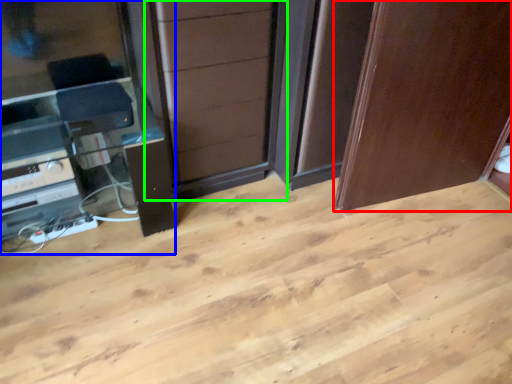
Question: Which object is positioned closest to door (highlighted by a red box)? Select from entertainment center (highlighted by a blue box) and screen door (highlighted by a green box).

Choices:
 (A) entertainment center
 (B) screen door

Answer: (B)